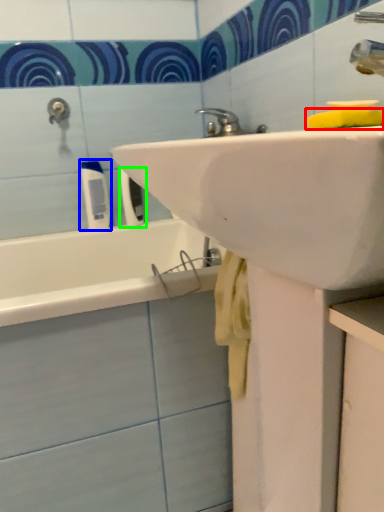
Question: Based on their relative distances, which object is farther from soap (highlighted by a red box)? Choose from toiletry (highlighted by a blue box) and toiletry (highlighted by a green box).

Choices:
 (A) toiletry
 (B) toiletry

Answer: (A)